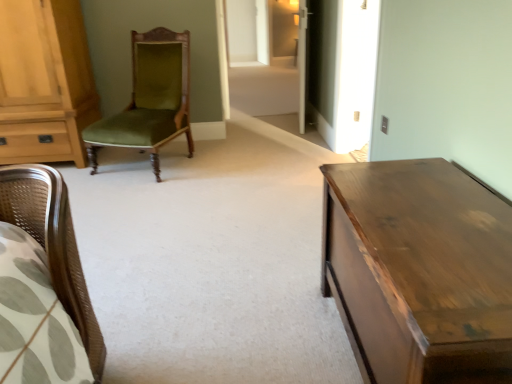
Identify the location of vacant area on top of shiny brown wooden table at right (from a real-world perspective). The width and height of the screenshot is (512, 384). (416, 221).